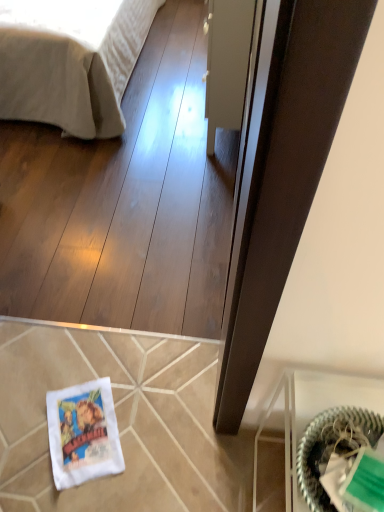
Find the location of a particular element. The width and height of the screenshot is (384, 512). blank space situated above white fabric bag at lower left (from a real-world perspective) is located at coordinates (83, 429).